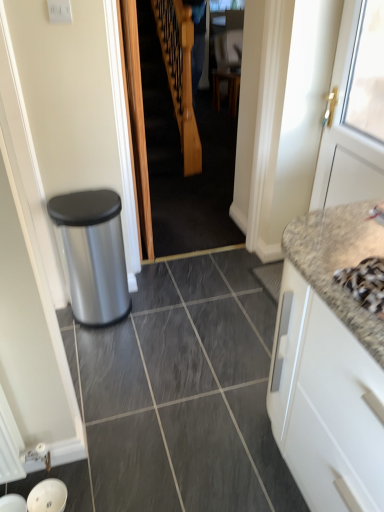
Question: Does granite at right have a greater width compared to blue fabric at center?

Choices:
 (A) yes
 (B) no

Answer: (A)

Question: Can you confirm if granite at right is positioned to the right of blue fabric at center?

Choices:
 (A) yes
 (B) no

Answer: (B)

Question: Considering the relative sizes of granite at right and blue fabric at center in the image provided, is granite at right thinner than blue fabric at center?

Choices:
 (A) no
 (B) yes

Answer: (A)

Question: Does granite at right have a larger size compared to blue fabric at center?

Choices:
 (A) yes
 (B) no

Answer: (A)

Question: Could blue fabric at center be considered to be inside granite at right?

Choices:
 (A) no
 (B) yes

Answer: (A)

Question: From the image's perspective, is granite at right above blue fabric at center?

Choices:
 (A) yes
 (B) no

Answer: (B)

Question: From a real-world perspective, does white matte cabinet at right stand above wooden staircase at center?

Choices:
 (A) yes
 (B) no

Answer: (B)

Question: From a real-world perspective, is white matte cabinet at right physically below wooden staircase at center?

Choices:
 (A) no
 (B) yes

Answer: (B)

Question: Is the depth of white matte cabinet at right greater than that of wooden staircase at center?

Choices:
 (A) yes
 (B) no

Answer: (B)

Question: Considering the relative sizes of white matte cabinet at right and wooden staircase at center in the image provided, is white matte cabinet at right smaller than wooden staircase at center?

Choices:
 (A) no
 (B) yes

Answer: (A)

Question: From the image's perspective, does white matte cabinet at right appear lower than wooden staircase at center?

Choices:
 (A) no
 (B) yes

Answer: (B)

Question: Can you confirm if white matte cabinet at right is wider than wooden staircase at center?

Choices:
 (A) yes
 (B) no

Answer: (A)

Question: Does wooden staircase at center have a lesser height compared to silver metallic faucet at upper right?

Choices:
 (A) no
 (B) yes

Answer: (A)